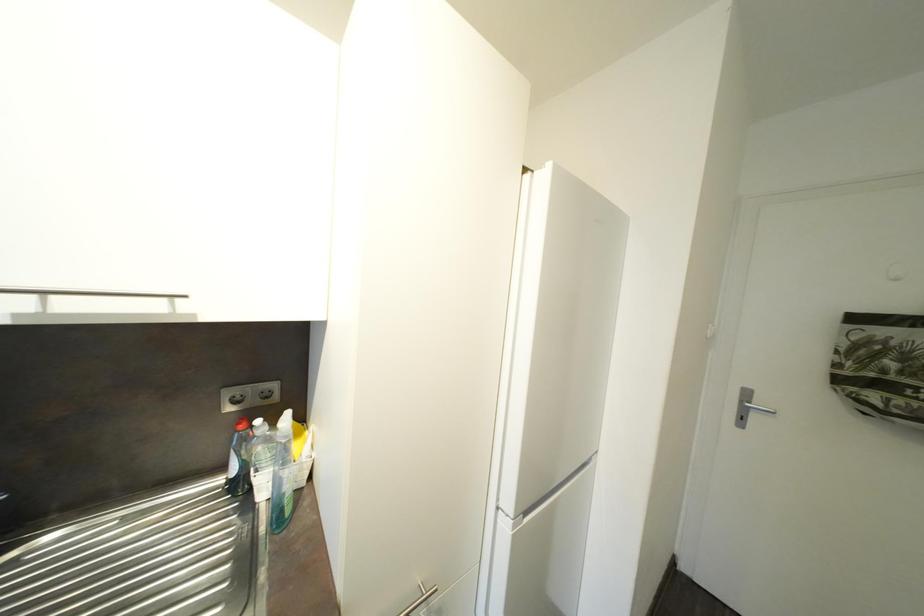
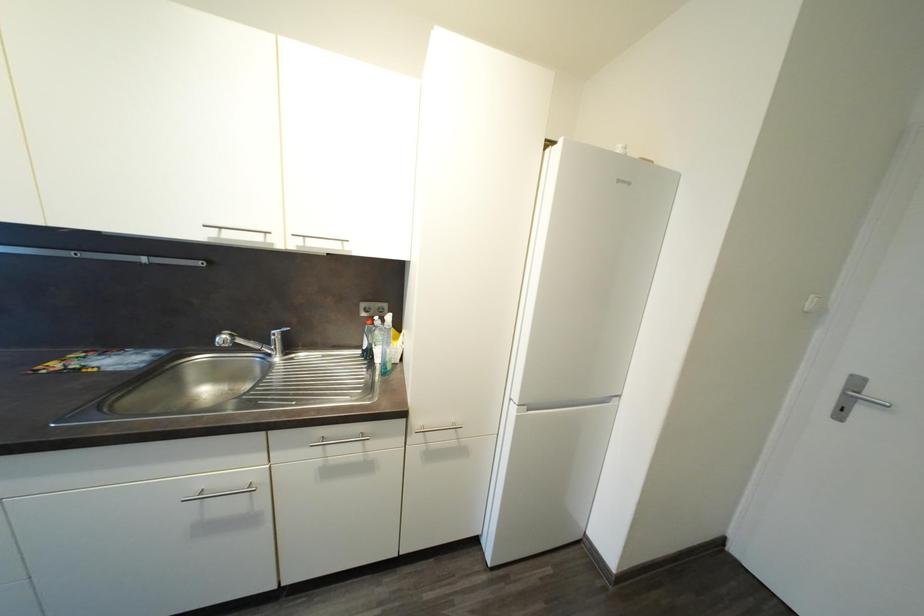
Question: The images are taken continuously from a first-person perspective. In which direction is your viewpoint rotating?

Choices:
 (A) Left
 (B) Right
 (C) Up
 (D) Down

Answer: (A)